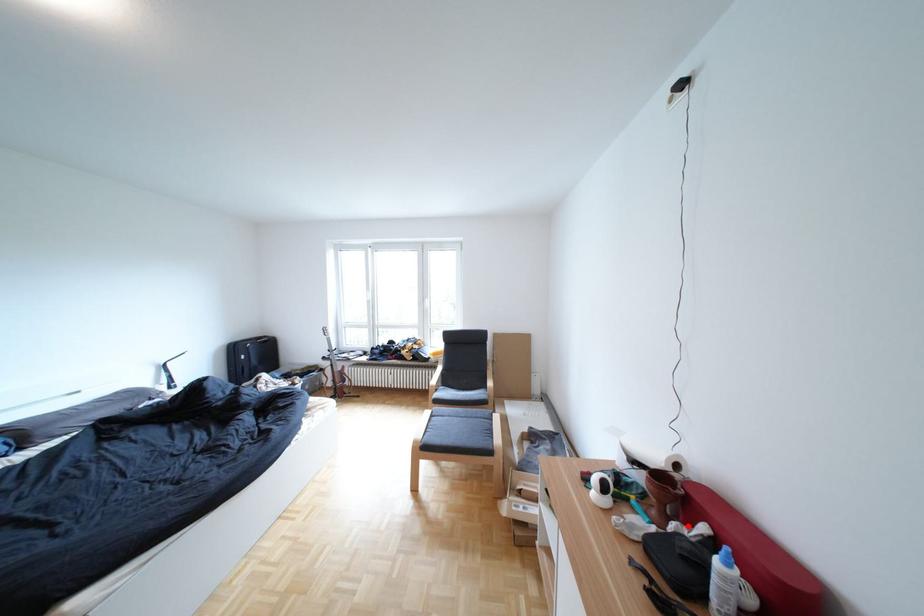
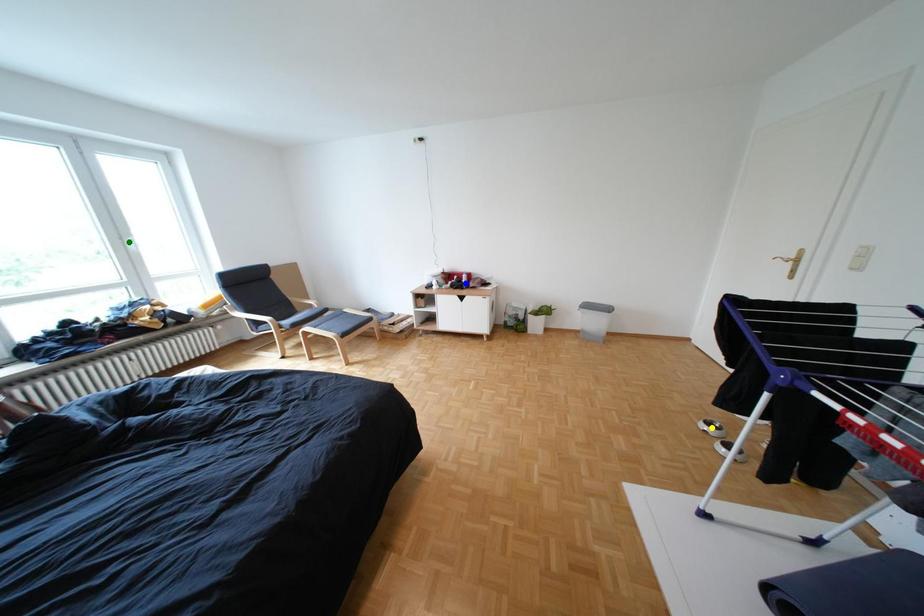
Question: I am providing you with two images of the same scene from different viewpoints. A red point is marked on the first image. You are given multiple points on the second image. Can you choose the point in image 2 that corresponds to the point in image 1?

Choices:
 (A) yellow point
 (B) blue point
 (C) green point

Answer: (B)